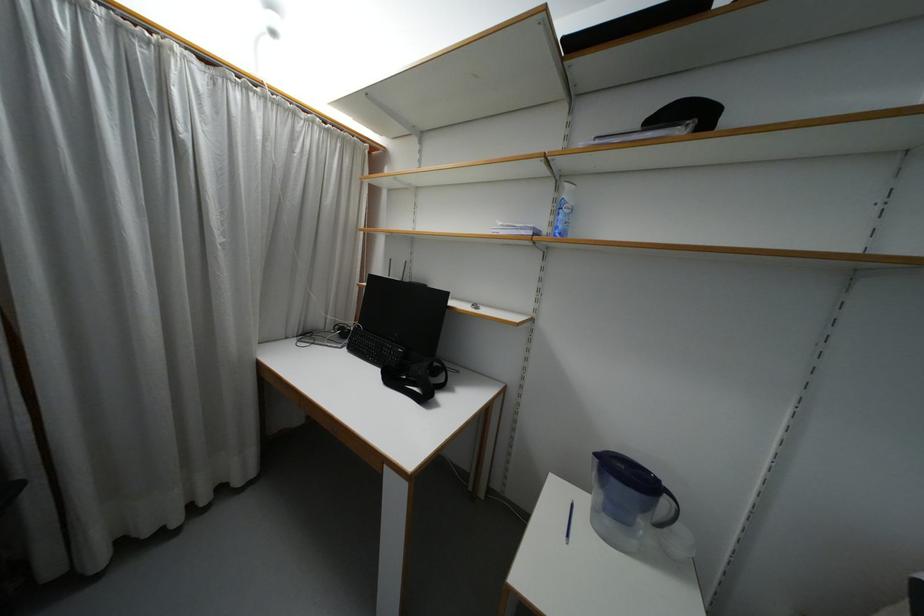
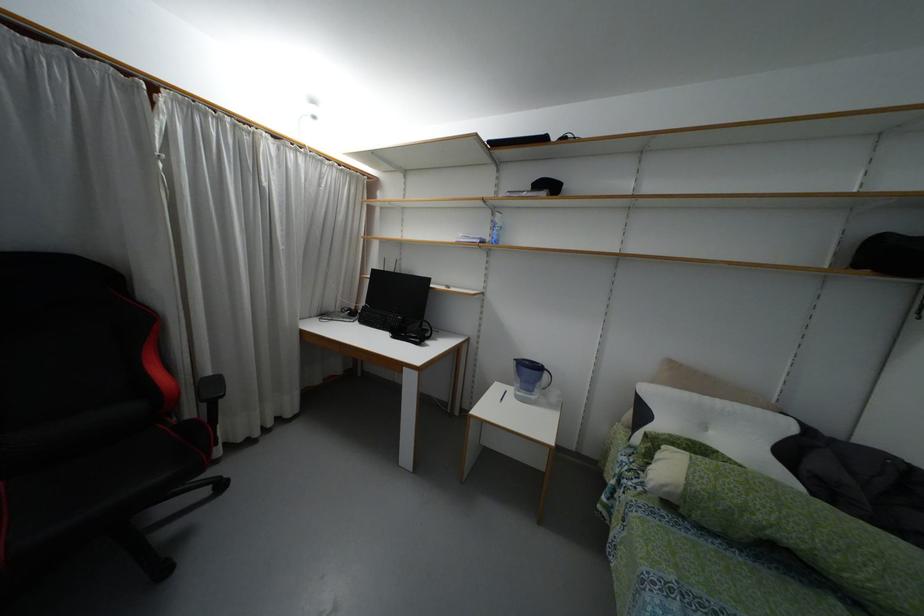
Locate, in the second image, the point that corresponds to [558,180] in the first image.

(493, 209)